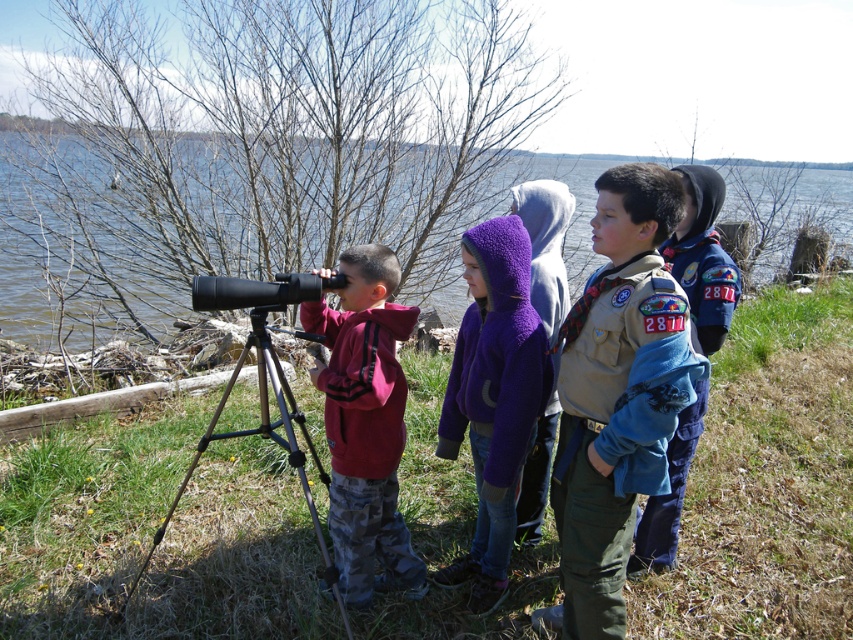
Question: In this image, where is clear blue water at center located relative to blue fleece jacket at center?

Choices:
 (A) right
 (B) left

Answer: (A)

Question: Estimate the real-world distances between objects in this image. Which object is farther from the khaki uniform at center?

Choices:
 (A) blue fleece jacket at center
 (B) matte red hoodie at center

Answer: (B)

Question: Which of the following is the closest to the observer?

Choices:
 (A) purple fleece jacket at center
 (B) khaki uniform at center
 (C) clear blue water at center

Answer: (B)

Question: Estimate the real-world distances between objects in this image. Which object is closer to the blue fleece jacket at center?

Choices:
 (A) clear blue water at center
 (B) matte red hoodie at center
 (C) black metal tripod at lower left

Answer: (B)

Question: Can you confirm if matte red hoodie at center is positioned below clear blue water at center?

Choices:
 (A) no
 (B) yes

Answer: (B)

Question: Where is khaki uniform at center located in relation to blue fleece jacket at center in the image?

Choices:
 (A) right
 (B) left

Answer: (B)